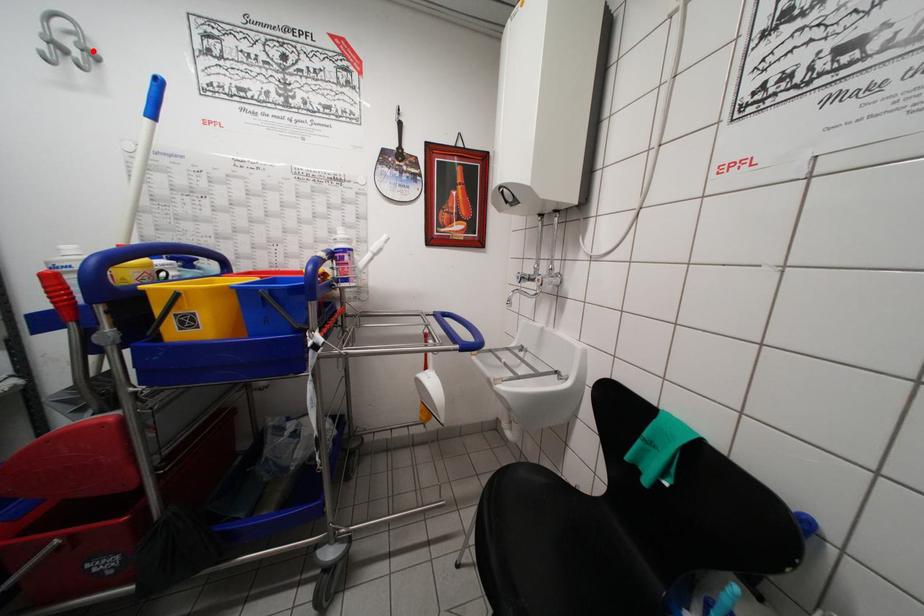
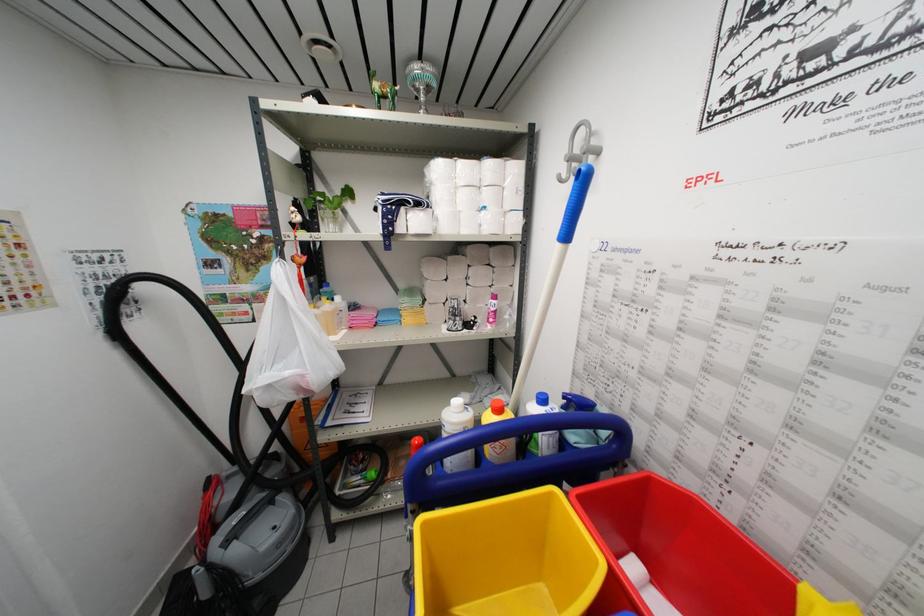
Find the pixel in the second image that matches the highlighted location in the first image.

(597, 148)